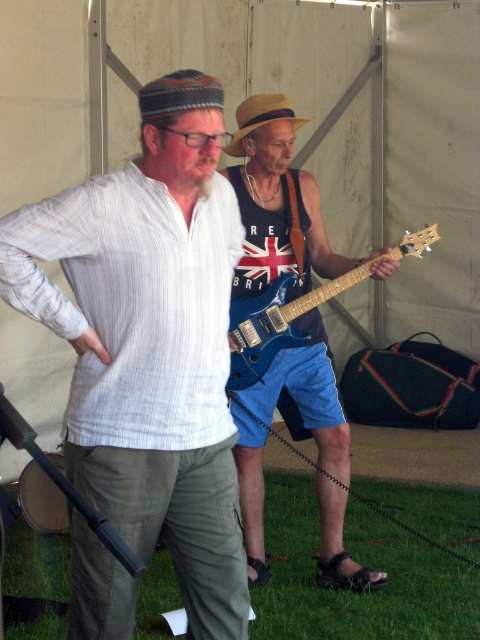
You are at a music festival and want to take a photo of both the matte white shirt at center and the blue glossy electric guitar at center. Since you can only focus on one object at a time, which one should you aim your camera at to ensure the other is still in the background?

You should aim your camera at the matte white shirt at center because it is positioned to the left of the blue glossy electric guitar at center, so if you focus on the shirt, the guitar will naturally be in the background.